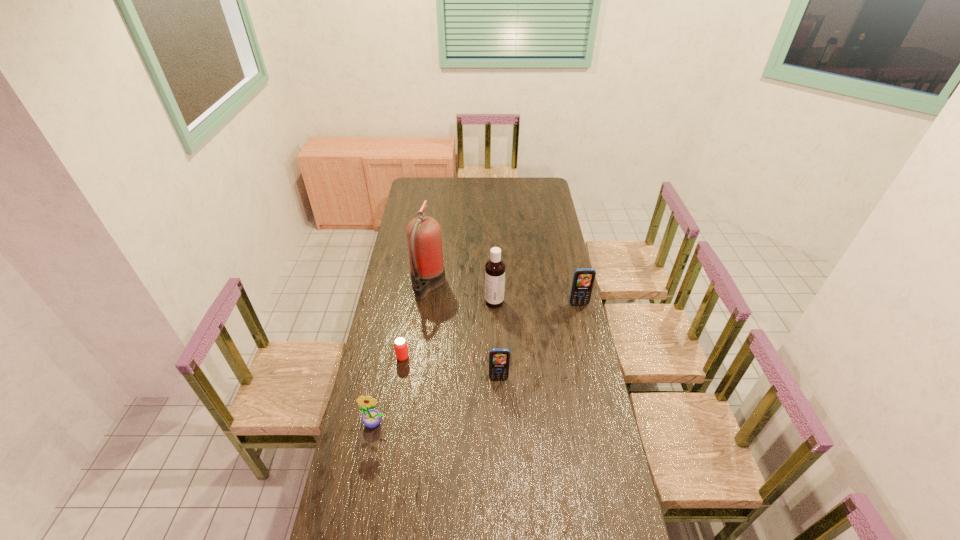
Locate an element on the screen. free space between the dishwasher detergent and the beer can is located at coordinates (448, 329).

Where is `vacant region between the beer can and the second tallest object`? vacant region between the beer can and the second tallest object is located at coordinates (448, 329).

Identify the location of free space between the right cellular telephone and the left cellular telephone. (539, 341).

Image resolution: width=960 pixels, height=540 pixels. I want to click on free spot between the fifth shortest object and the right cellular telephone, so click(537, 303).

Locate an element on the screen. This screenshot has height=540, width=960. empty location between the fourth farthest object and the tallest object is located at coordinates (416, 321).

Find the location of a particular element. Image resolution: width=960 pixels, height=540 pixels. vacant area between the nearest object and the shorter cellular telephone is located at coordinates (437, 401).

The height and width of the screenshot is (540, 960). What are the coordinates of `object that can be found as the fourth closest to the fifth farthest object` in the screenshot? It's located at (424, 240).

Where is `the third closest object to the dishwasher detergent`? the third closest object to the dishwasher detergent is located at coordinates (499, 358).

The image size is (960, 540). In order to click on free spot that satisfies the following two spatial constraints: 1. at the nozzle of the tallest object; 2. on the front-facing side of the sunflower in this screenshot , I will do `click(410, 423)`.

The image size is (960, 540). I want to click on vacant region that satisfies the following two spatial constraints: 1. at the nozzle of the fire extinguisher; 2. on the front-facing side of the nearest object, so click(410, 423).